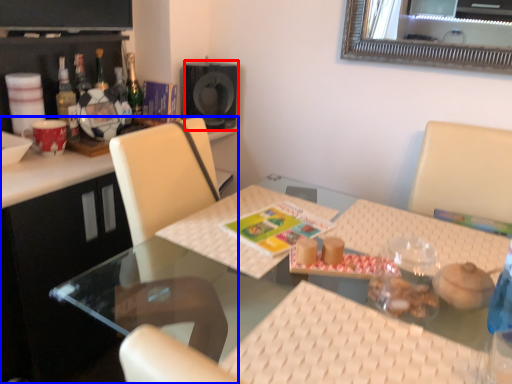
Question: Which object is closer to the camera taking this photo, speaker (highlighted by a red box) or desk (highlighted by a blue box)?

Choices:
 (A) speaker
 (B) desk

Answer: (B)